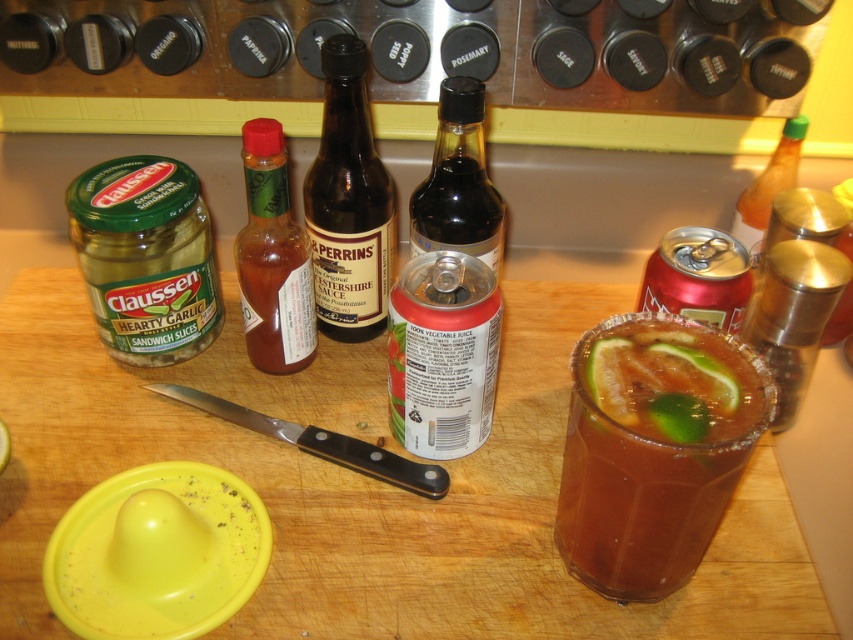
You are standing in front of the kitchen countertop scene. There are two points marked on the image, one at coordinate point (180, 445) and the other at point (389, 252). Which point is closer to you?

Point (180, 445) is closer to the viewer than point (389, 252).

You are preparing a meal and need to stack items on the wooden cutting board at center and the brown glass bottle at center. Which item should you place on top to ensure stability?

The wooden cutting board at center has a greater height compared to the brown glass bottle at center, so placing items on top of the cutting board would provide a more stable base for stacking.

Based on the photo, you are preparing a meal and need to place both the wooden cutting board at center and the brown glass bottle at center on a shelf. The shelf has limited space, and you want to ensure the smaller item fits behind the larger one. Which item should you place first on the shelf?

The wooden cutting board at center is larger than the brown glass bottle at center, so you should place the wooden cutting board at center first to allow the smaller bottle to fit behind it.